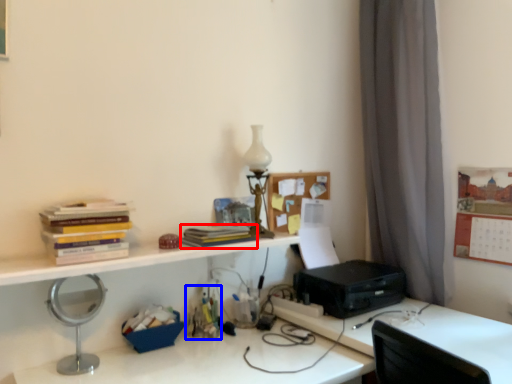
Question: Which of the following is the closest to the observer, paperback book (highlighted by a red box) or stationery (highlighted by a blue box)?

Choices:
 (A) paperback book
 (B) stationery

Answer: (A)